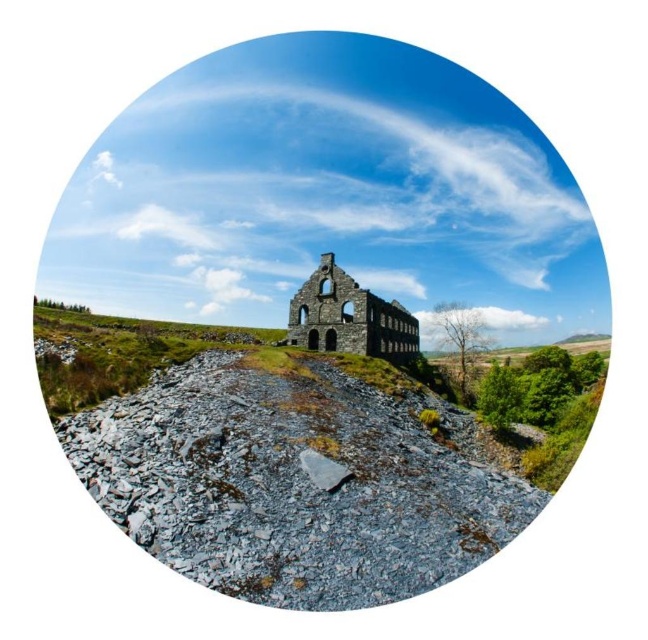
You are a geologist examining the circular fisheye lens image of a dilapidated stone structure in a rural area. You notice a gray rock at center and a brown stone church at center. Based on the image, which object occupies a larger horizontal space in the scene?

The gray rock at center might be wider than brown stone church at center.

You are a photographer standing at the edge of the rugged terrain. You want to capture a photo of the brown stone church at center without the gray rough stone at lower center blocking the view. Is the church tall enough to be visible above the stone?

The brown stone church at center is much taller than the gray rough stone at lower center, so yes, the church will be visible above the stone in your photo.

You are a hiker who has stumbled upon this abandoned structure. You notice a gray rock at center and a gray rough stone at lower center. Which object is positioned higher up in the scene?

The gray rough stone at lower center is positioned higher up than the gray rock at center.